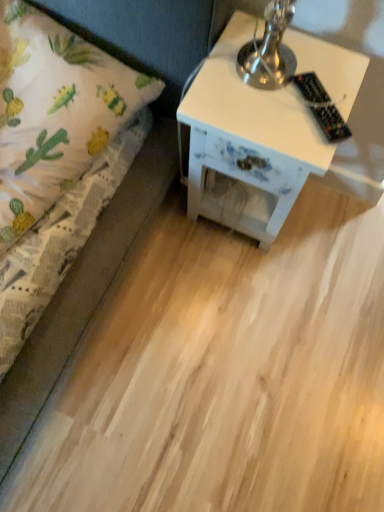
Where is `free spot above white painted wood nightstand at right (from a real-world perspective)`? free spot above white painted wood nightstand at right (from a real-world perspective) is located at coordinates (282, 86).